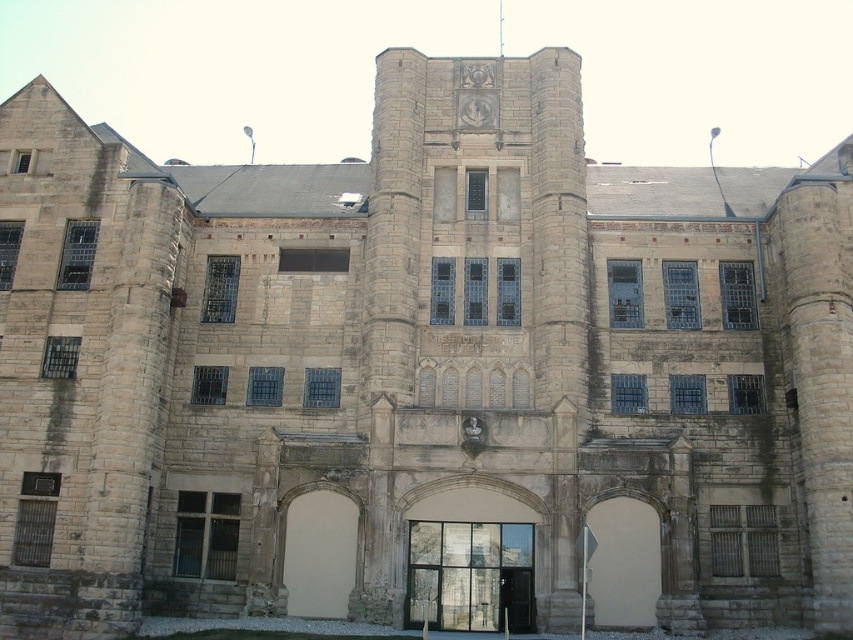
You are a GUI agent. You are given a task and a screenshot of the screen. Output one action in this format:
    pyautogui.click(x=<x>, y=<y>)
    Task: Click on the smooth beige door at center
    The height and width of the screenshot is (640, 853).
    Given the screenshot: What is the action you would take?
    pyautogui.click(x=624, y=563)

Is point (647, 544) positioned in front of point (310, 538)?

Yes, point (647, 544) is closer to viewer.

The width and height of the screenshot is (853, 640). Find the location of `smooth beige door at center`. smooth beige door at center is located at coordinates (624, 563).

This screenshot has width=853, height=640. I want to click on smooth beige door at center, so click(624, 563).

Image resolution: width=853 pixels, height=640 pixels. What do you see at coordinates (469, 576) in the screenshot?
I see `clear glass door at center` at bounding box center [469, 576].

Is point (474, 563) behind point (312, 602)?

Yes.

Where is `clear glass door at center`? The width and height of the screenshot is (853, 640). clear glass door at center is located at coordinates (469, 576).

Can you confirm if clear glass door at center is shorter than smooth beige door at center?

Yes, clear glass door at center is shorter than smooth beige door at center.

Does point (485, 589) come closer to viewer compared to point (648, 561)?

No, (485, 589) is further to viewer.

In order to click on clear glass door at center in this screenshot , I will do `click(469, 576)`.